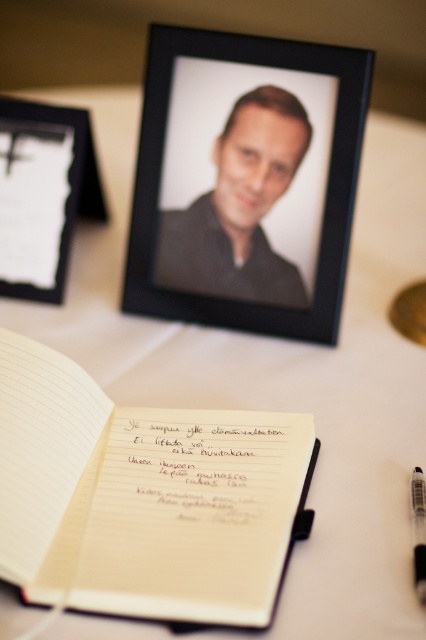
Question: Considering the relative positions of black matte picture frame at upper left and black plastic pen at lower right in the image provided, where is black matte picture frame at upper left located with respect to black plastic pen at lower right?

Choices:
 (A) below
 (B) above

Answer: (B)

Question: Which is nearer to the black matte picture frame at upper left?

Choices:
 (A) matte black portrait at center
 (B) brown paper notebook at center
 (C) black matte picture frame at upper center
 (D) black plastic pen at lower right

Answer: (C)

Question: Which point is farther to the camera?

Choices:
 (A) black matte picture frame at upper left
 (B) black plastic pen at lower right
 (C) white paper notebook at center

Answer: (A)

Question: Is brown paper notebook at center above black plastic pen at lower right?

Choices:
 (A) yes
 (B) no

Answer: (A)

Question: Is white paper notebook at center further to camera compared to black matte picture frame at upper center?

Choices:
 (A) yes
 (B) no

Answer: (B)

Question: Which object is the farthest from the black plastic pen at lower right?

Choices:
 (A) black matte picture frame at upper center
 (B) black matte picture frame at upper left
 (C) brown paper notebook at center

Answer: (B)